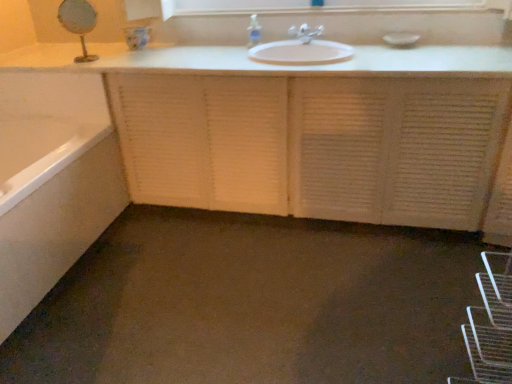
Question: Looking at their shapes, would you say matte white faucet at center is wider or thinner than clear plastic soap dispenser at upper center?

Choices:
 (A) thin
 (B) wide

Answer: (B)

Question: From a real-world perspective, is matte white faucet at center physically located above or below clear plastic soap dispenser at upper center?

Choices:
 (A) above
 (B) below

Answer: (B)

Question: Which object is the closest to the matte white faucet at center?

Choices:
 (A) white textured cabinet at center
 (B) white glossy bathtub at lower left
 (C) gold metallic mirror at upper left
 (D) clear plastic soap dispenser at upper center
 (E) white glossy medicine cabinet at upper center

Answer: (D)

Question: Which of these objects is positioned closest to the matte white faucet at center?

Choices:
 (A) white glossy bathtub at lower left
 (B) white glossy medicine cabinet at upper center
 (C) clear plastic soap dispenser at upper center
 (D) white textured cabinet at center
 (E) gold metallic mirror at upper left

Answer: (C)